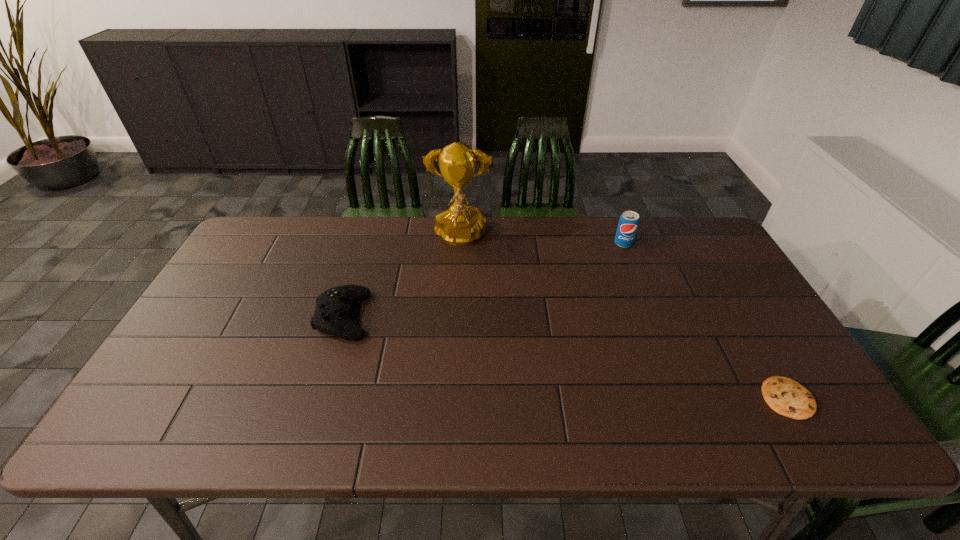
The image size is (960, 540). What are the coordinates of `vacant area that lies between the tallest object and the control` in the screenshot? It's located at [x=401, y=277].

Image resolution: width=960 pixels, height=540 pixels. In order to click on free space between the second shortest object and the third object from left to right in this screenshot , I will do `click(483, 280)`.

Where is `free spot between the rightmost object and the control`? The height and width of the screenshot is (540, 960). free spot between the rightmost object and the control is located at coordinates (565, 357).

The height and width of the screenshot is (540, 960). I want to click on free area in between the control and the shortest object, so click(x=565, y=357).

Identify the location of free space between the award and the soda can. The height and width of the screenshot is (540, 960). (541, 241).

This screenshot has height=540, width=960. I want to click on unoccupied area between the award and the second tallest object, so click(541, 241).

Where is `vacant area between the award and the nearest object`? vacant area between the award and the nearest object is located at coordinates (623, 318).

Find the location of a particular element. The width and height of the screenshot is (960, 540). empty location between the control and the cookie is located at coordinates (565, 357).

The width and height of the screenshot is (960, 540). In order to click on vacant space that's between the soda can and the cookie in this screenshot , I will do [x=706, y=321].

You are a GUI agent. You are given a task and a screenshot of the screen. Output one action in this format:
    pyautogui.click(x=<x>, y=<y>)
    Task: Click on the free spot between the second object from left to right and the soda can
    This screenshot has width=960, height=540.
    Given the screenshot: What is the action you would take?
    pyautogui.click(x=541, y=241)